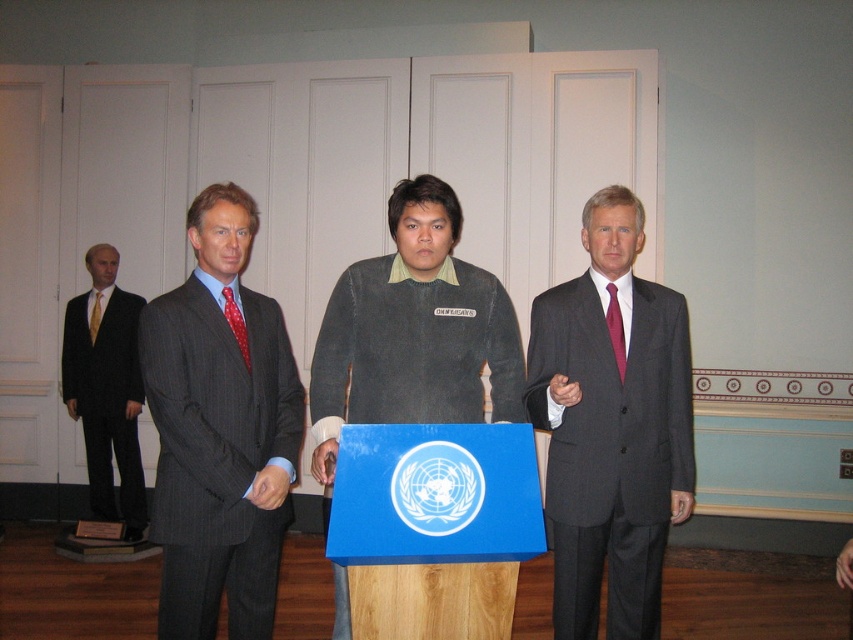
You are a photographer setting up for a group photo. You need to arrange the dark gray sweater at center and the maroon silk tie at right so that they are aligned properly. According to the scene description, which object should be placed to the left when positioning them side by side?

The dark gray sweater at center should be placed to the left of the maroon silk tie at right because in the scene description, the dark gray sweater at center is positioned on the left side of the maroon silk tie at right.

You are an event planner arranging seating for a diplomatic meeting. You need to seat the person in the yellow silk tie at left and the person in the dark gray sweater at center in a row facing the podium. To ensure proper protocol, the person with the higher rank should be seated to the right of the other. Based on their positions in the image, which person should be seated on the right?

The dark gray sweater at center should be seated to the right because in the image, the dark gray sweater at center is already positioned to the right of the yellow silk tie at left, indicating a higher rank.

You are a photographer setting up a tripod to take a group photo of the two people at the center. The minimum distance your camera can focus is 40 centimeters. Based on the scene, will you be able to capture both the matte gray suit at center and the dark gray sweater at center in sharp focus?

The matte gray suit at center and dark gray sweater at center are 38.42 centimeters apart from each other. Since the minimum focusing distance is 40 centimeters, the camera cannot capture both in sharp focus as they are closer than the required distance.